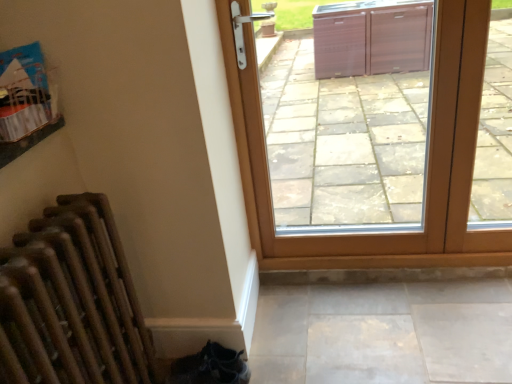
The height and width of the screenshot is (384, 512). What do you see at coordinates (91, 287) in the screenshot?
I see `wooden radiator at lower left` at bounding box center [91, 287].

Image resolution: width=512 pixels, height=384 pixels. I want to click on wooden radiator at lower left, so click(91, 287).

What do you see at coordinates (426, 159) in the screenshot? I see `brown wooden door at center` at bounding box center [426, 159].

Locate an element on the screen. brown wooden door at center is located at coordinates (426, 159).

Image resolution: width=512 pixels, height=384 pixels. I want to click on wooden radiator at lower left, so click(x=91, y=287).

Which object is positioned more to the left, brown wooden door at center or wooden radiator at lower left?

wooden radiator at lower left.

Is brown wooden door at center further to camera compared to wooden radiator at lower left?

Yes, the depth of brown wooden door at center is greater than that of wooden radiator at lower left.

Is point (291, 252) positioned in front of point (71, 281)?

No, (291, 252) is further to viewer.

From the image's perspective, who appears lower, brown wooden door at center or wooden radiator at lower left?

From the image's view, wooden radiator at lower left is below.

From a real-world perspective, is brown wooden door at center over wooden radiator at lower left?

Yes.

Considering the sizes of objects brown wooden door at center and wooden radiator at lower left in the image provided, who is thinner, brown wooden door at center or wooden radiator at lower left?

brown wooden door at center.

Who is taller, brown wooden door at center or wooden radiator at lower left?

brown wooden door at center.

Does brown wooden door at center have a larger size compared to wooden radiator at lower left?

Correct, brown wooden door at center is larger in size than wooden radiator at lower left.

Is brown wooden door at center outside of wooden radiator at lower left?

Absolutely, brown wooden door at center is external to wooden radiator at lower left.

Is brown wooden door at center positioned far away from wooden radiator at lower left?

No, there isn't a large distance between brown wooden door at center and wooden radiator at lower left.

In the scene shown: Is brown wooden door at center oriented away from wooden radiator at lower left?

No, brown wooden door at center is not facing away from wooden radiator at lower left.

Locate an element on the screen. Image resolution: width=512 pixels, height=384 pixels. door above the wooden radiator at lower left (from a real-world perspective) is located at coordinates (426, 159).

From the picture: Which is more to the left, wooden radiator at lower left or brown wooden door at center?

From the viewer's perspective, wooden radiator at lower left appears more on the left side.

From the picture: Which object is more forward, wooden radiator at lower left or brown wooden door at center?

wooden radiator at lower left.

Considering the positions of point (154, 359) and point (356, 247), is point (154, 359) closer or farther from the camera than point (356, 247)?

Point (154, 359) appears to be closer to the viewer than point (356, 247).

From the image's perspective, which is below, wooden radiator at lower left or brown wooden door at center?

wooden radiator at lower left appears lower in the image.

From a real-world perspective, between wooden radiator at lower left and brown wooden door at center, who is vertically higher?

brown wooden door at center is physically above.

Looking at their sizes, would you say wooden radiator at lower left is wider or thinner than brown wooden door at center?

Considering their sizes, wooden radiator at lower left looks broader than brown wooden door at center.

Between wooden radiator at lower left and brown wooden door at center, which one has more height?

Standing taller between the two is brown wooden door at center.

Based on their sizes in the image, would you say wooden radiator at lower left is bigger or smaller than brown wooden door at center?

In the image, wooden radiator at lower left appears to be smaller than brown wooden door at center.

Is wooden radiator at lower left completely or partially outside of brown wooden door at center?

Yes, wooden radiator at lower left is located beyond the bounds of brown wooden door at center.

Is the surface of wooden radiator at lower left in direct contact with brown wooden door at center?

No, wooden radiator at lower left is not with brown wooden door at center.

Is wooden radiator at lower left positioned with its back to brown wooden door at center?

That's not correct — wooden radiator at lower left is not looking away from brown wooden door at center.

You are a GUI agent. You are given a task and a screenshot of the screen. Output one action in this format:
    pyautogui.click(x=<x>, y=<y>)
    Task: Click on the door that is on the right side of wooden radiator at lower left
    This screenshot has width=512, height=384.
    Given the screenshot: What is the action you would take?
    pyautogui.click(x=426, y=159)

The height and width of the screenshot is (384, 512). What are the coordinates of `door on the right of the wooden radiator at lower left` in the screenshot? It's located at (426, 159).

Find the location of a particular element. The image size is (512, 384). radiator in front of the brown wooden door at center is located at coordinates (91, 287).